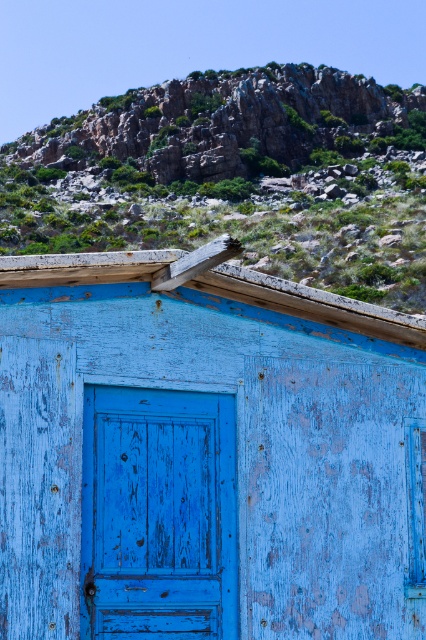
Looking at this image, between blue wooden door at center and rusty rock at upper center, which one has less height?

With less height is blue wooden door at center.

Does blue wooden door at center come in front of rusty rock at upper center?

Yes, it is.

Is point (161, 417) positioned in front of point (276, 104)?

Yes, it is in front of point (276, 104).

I want to click on blue wooden door at center, so click(x=158, y=515).

Is rusty wood hut at center smaller than rusty rock at upper center?

Correct, rusty wood hut at center occupies less space than rusty rock at upper center.

Does point (149, 579) come in front of point (267, 108)?

Yes, point (149, 579) is closer to viewer.

Find the location of a particular element. This screenshot has width=426, height=640. rusty wood hut at center is located at coordinates (206, 452).

Who is higher up, rusty wood hut at center or blue wooden door at center?

rusty wood hut at center

Measure the distance between rusty wood hut at center and camera.

rusty wood hut at center is 8.80 meters from camera.

At what (x,y) coordinates should I click in order to perform the action: click on rusty wood hut at center. Please return your answer as a coordinate pair (x, y). Looking at the image, I should click on click(206, 452).